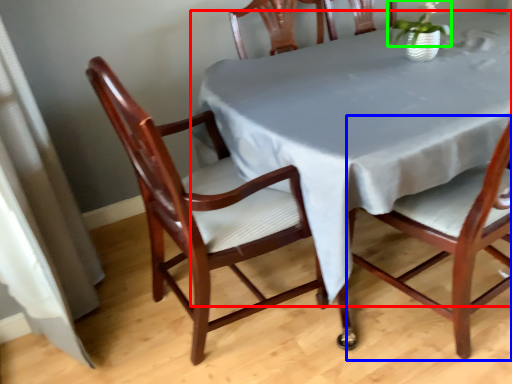
Question: Which object is the closest to the table (highlighted by a red box)? Choose among these: chair (highlighted by a blue box) or plant (highlighted by a green box).

Choices:
 (A) chair
 (B) plant

Answer: (A)